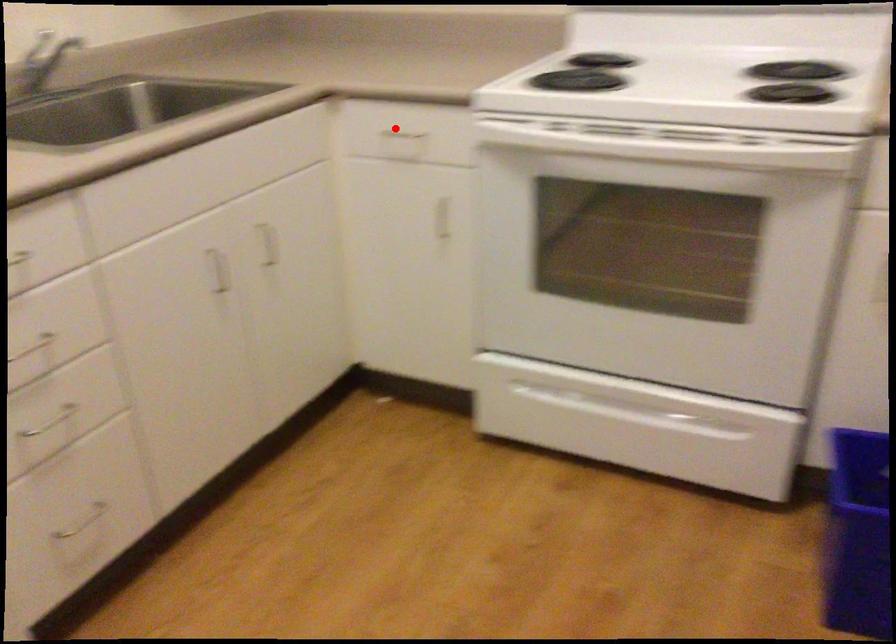
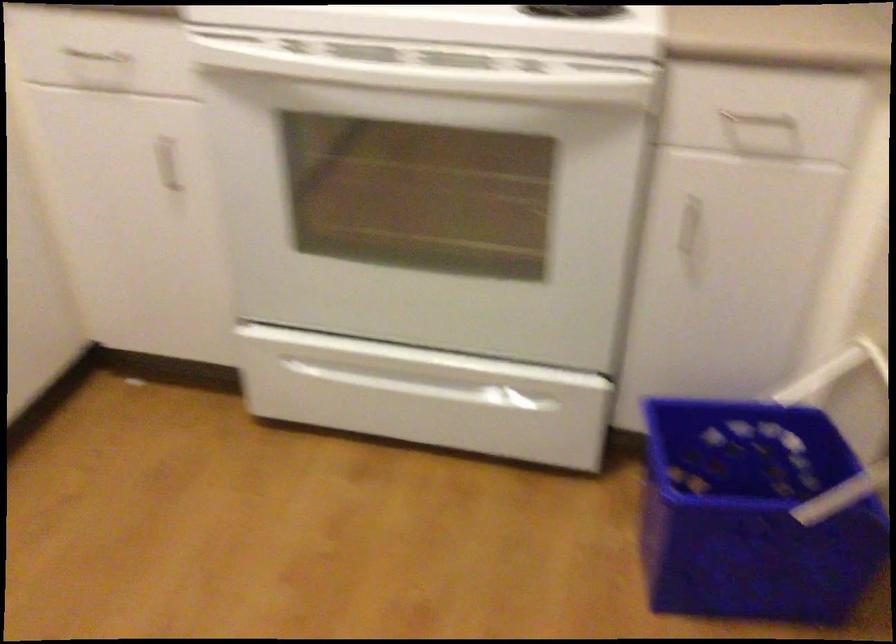
Question: I am providing you with two images of the same scene from different viewpoints. Image1 has a red point marked. In image2, the corresponding 3D location appears at what relative position? Reply with the corresponding letter.

Choices:
 (A) Closer
 (B) Farther

Answer: (A)